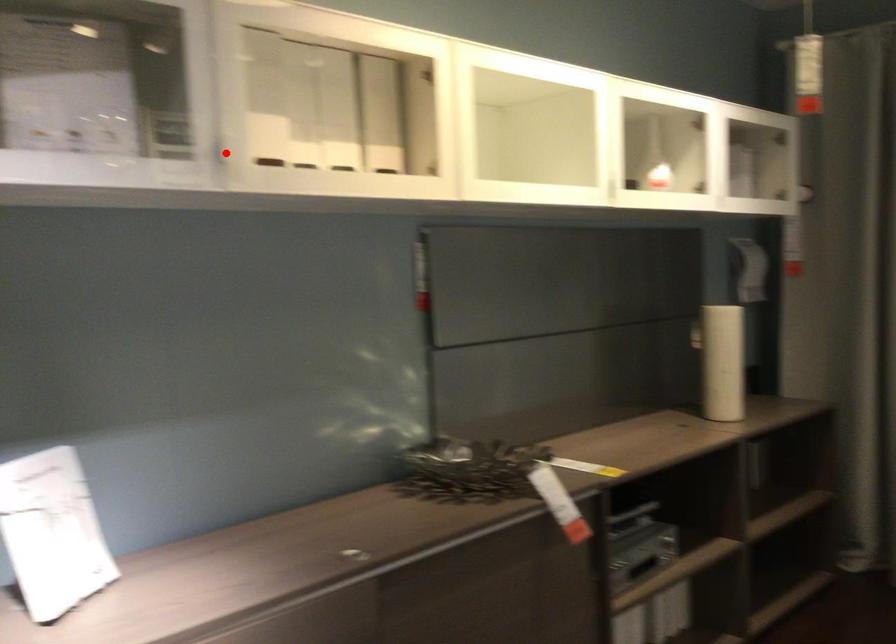
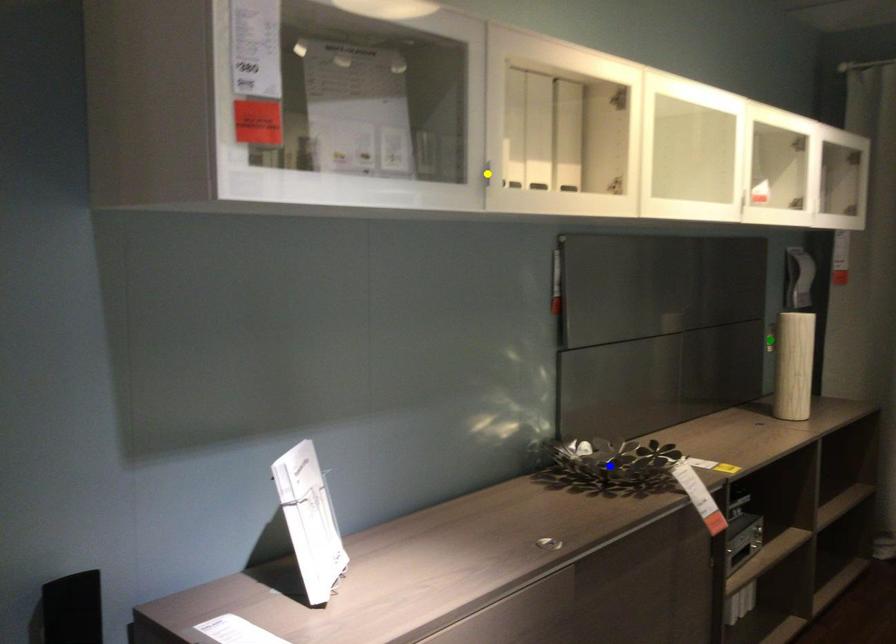
Question: I am providing you with two images of the same scene from different viewpoints. A red point is marked on the first image. You are given multiple points on the second image. Which point in image 2 represents the same 3d spot as the red point in image 1?

Choices:
 (A) yellow point
 (B) green point
 (C) blue point

Answer: (A)